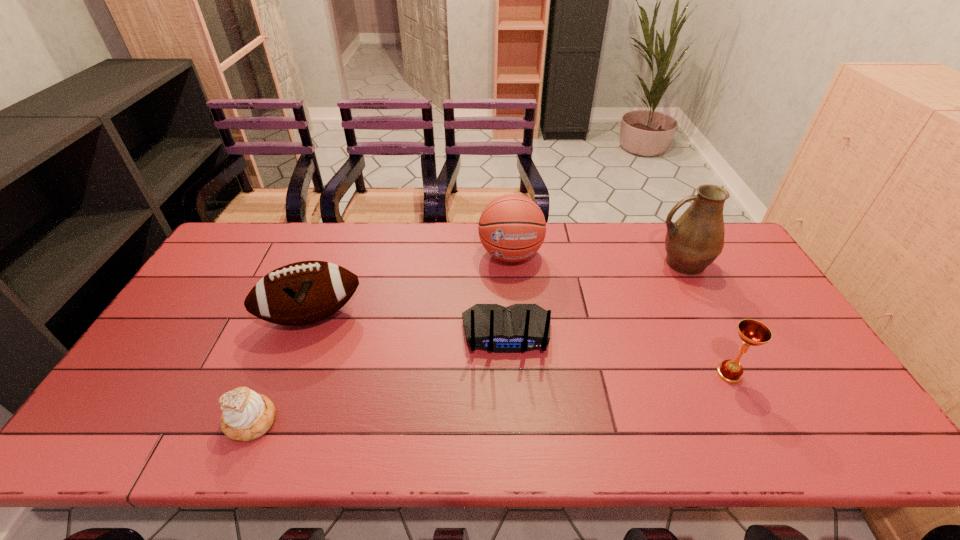
Locate an element on the screen. The image size is (960, 540). vacant region between the nearest object and the basketball is located at coordinates (381, 338).

At what (x,y) coordinates should I click in order to perform the action: click on vacant area that lies between the nearest object and the router. Please return your answer as a coordinate pair (x, y). Image resolution: width=960 pixels, height=540 pixels. Looking at the image, I should click on (379, 377).

Identify which object is the nearest to the tallest object. Please provide its 2D coordinates. Your answer should be formatted as a tuple, i.e. [(x, y)], where the tuple contains the x and y coordinates of a point satisfying the conditions above.

[(753, 333)]

Identify the location of the second closest object to the nearest object. (517, 328).

Where is `vacant space that satisfies the following two spatial constraints: 1. on the logo side of the basketball; 2. on the handle side of the tallest object`? This screenshot has width=960, height=540. vacant space that satisfies the following two spatial constraints: 1. on the logo side of the basketball; 2. on the handle side of the tallest object is located at coordinates (512, 264).

This screenshot has height=540, width=960. Find the location of `free spot that satisfies the following two spatial constraints: 1. on the back side of the nearest object; 2. on the left side of the chalice`. free spot that satisfies the following two spatial constraints: 1. on the back side of the nearest object; 2. on the left side of the chalice is located at coordinates (271, 374).

Image resolution: width=960 pixels, height=540 pixels. Identify the location of vacant position in the image that satisfies the following two spatial constraints: 1. on the back side of the pastry; 2. on the right side of the second nearest object. (271, 374).

Image resolution: width=960 pixels, height=540 pixels. Identify the location of free space that satisfies the following two spatial constraints: 1. on the back side of the nearest object; 2. on the handle side of the pitcher. (318, 264).

Where is `free space that satisfies the following two spatial constraints: 1. on the back side of the football (American); 2. on the left side of the nearest object`? free space that satisfies the following two spatial constraints: 1. on the back side of the football (American); 2. on the left side of the nearest object is located at coordinates tap(296, 316).

Where is `vacant space that satisfies the following two spatial constraints: 1. on the back side of the nearest object; 2. on the handle side of the tallest object`? vacant space that satisfies the following two spatial constraints: 1. on the back side of the nearest object; 2. on the handle side of the tallest object is located at coordinates (318, 264).